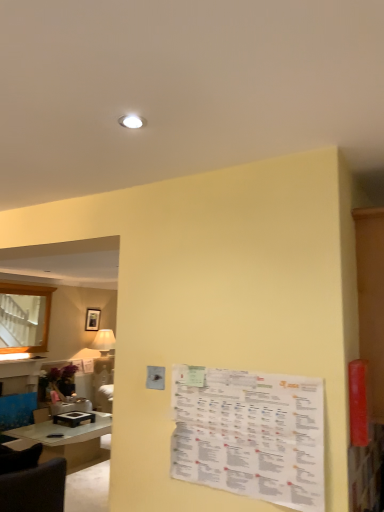
Describe the element at coordinates (251, 435) in the screenshot. I see `white paper menu at center` at that location.

Describe the element at coordinates (65, 440) in the screenshot. I see `clear glass table at lower left` at that location.

This screenshot has width=384, height=512. I want to click on white paper menu at center, so click(251, 435).

Can you confirm if white paper menu at center is positioned to the left of clear glass table at lower left?

No.

Consider the image. From a real-world perspective, relative to clear glass table at lower left, is white paper menu at center vertically above or below?

white paper menu at center is situated higher than clear glass table at lower left in the real world.

From the image's perspective, is white paper menu at center above or below clear glass table at lower left?

Clearly, from the image's perspective, white paper menu at center is above clear glass table at lower left.

Could clear glass table at lower left be considered to be inside white paper menu at center?

No, white paper menu at center does not contain clear glass table at lower left.

Is the position of clear glass table at lower left more distant than that of white paper menu at center?

Yes, clear glass table at lower left is behind white paper menu at center.

The width and height of the screenshot is (384, 512). In order to click on menu above the clear glass table at lower left (from the image's perspective) in this screenshot , I will do `click(251, 435)`.

From the image's perspective, is matte black picture frame at upper center located beneath white paper menu at center?

Yes.

Is matte black picture frame at upper center oriented towards white paper menu at center?

No, matte black picture frame at upper center is not aimed at white paper menu at center.

Considering the relative positions of matte black picture frame at upper center and white paper menu at center in the image provided, is matte black picture frame at upper center to the left of white paper menu at center from the viewer's perspective?

Correct, you'll find matte black picture frame at upper center to the left of white paper menu at center.

Based on their sizes in the image, would you say matte black picture frame at upper center is bigger or smaller than white paper menu at center?

Clearly, matte black picture frame at upper center is larger in size than white paper menu at center.

Who is taller, matte black picture frame at upper center or clear glass table at lower left?

Standing taller between the two is clear glass table at lower left.

Locate an element on the screen. table below the matte black picture frame at upper center (from the image's perspective) is located at coordinates (65, 440).

Can we say matte black picture frame at upper center lies outside clear glass table at lower left?

matte black picture frame at upper center lies outside clear glass table at lower left's area.

From the picture: From a real-world perspective, is white paper menu at center positioned above or below matte black picture frame at upper center?

white paper menu at center is below matte black picture frame at upper center.

Is white paper menu at center not inside matte black picture frame at upper center?

Yes, white paper menu at center is not within matte black picture frame at upper center.

From the image's perspective, who appears lower, white paper menu at center or matte black picture frame at upper center?

matte black picture frame at upper center, from the image's perspective.

Is white paper menu at center not near matte black picture frame at upper center?

Yes, white paper menu at center is far from matte black picture frame at upper center.

Is clear glass table at lower left further to the viewer compared to matte black picture frame at upper center?

No, it is in front of matte black picture frame at upper center.

From the image's perspective, who appears lower, clear glass table at lower left or matte black picture frame at upper center?

clear glass table at lower left, from the image's perspective.

Based on the photo, is clear glass table at lower left outside of matte black picture frame at upper center?

Yes, clear glass table at lower left is located beyond the bounds of matte black picture frame at upper center.

This screenshot has height=512, width=384. I want to click on menu on the right of clear glass table at lower left, so click(251, 435).

Identify the location of menu in front of the clear glass table at lower left. The image size is (384, 512). (251, 435).

Based on their spatial positions, is white paper menu at center or clear glass table at lower left further from matte black picture frame at upper center?

Based on the image, white paper menu at center appears to be further to matte black picture frame at upper center.

When comparing their distances from matte black picture frame at upper center, does clear glass table at lower left or white paper menu at center seem further?

Among the two, white paper menu at center is located further to matte black picture frame at upper center.

Which object lies nearer to the anchor point clear glass table at lower left, white paper menu at center or matte black picture frame at upper center?

The object closer to clear glass table at lower left is matte black picture frame at upper center.

Considering their positions, is clear glass table at lower left positioned closer to white paper menu at center than matte black picture frame at upper center?

clear glass table at lower left is positioned closer to the anchor white paper menu at center.

Based on their spatial positions, is matte black picture frame at upper center or white paper menu at center closer to clear glass table at lower left?

matte black picture frame at upper center.

Based on their spatial positions, is matte black picture frame at upper center or clear glass table at lower left closer to white paper menu at center?

Based on the image, clear glass table at lower left appears to be nearer to white paper menu at center.

At what (x,y) coordinates should I click in order to perform the action: click on table located between white paper menu at center and matte black picture frame at upper center in the depth direction. Please return your answer as a coordinate pair (x, y). This screenshot has width=384, height=512. Looking at the image, I should click on (65, 440).